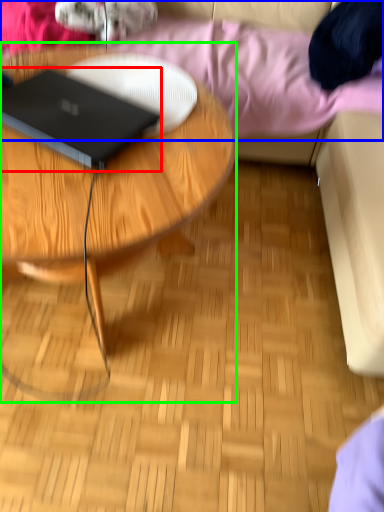
Question: Considering the real-world distances, which object is farthest from laptop (highlighted by a red box)? bedding (highlighted by a blue box) or coffee table (highlighted by a green box)?

Choices:
 (A) bedding
 (B) coffee table

Answer: (A)